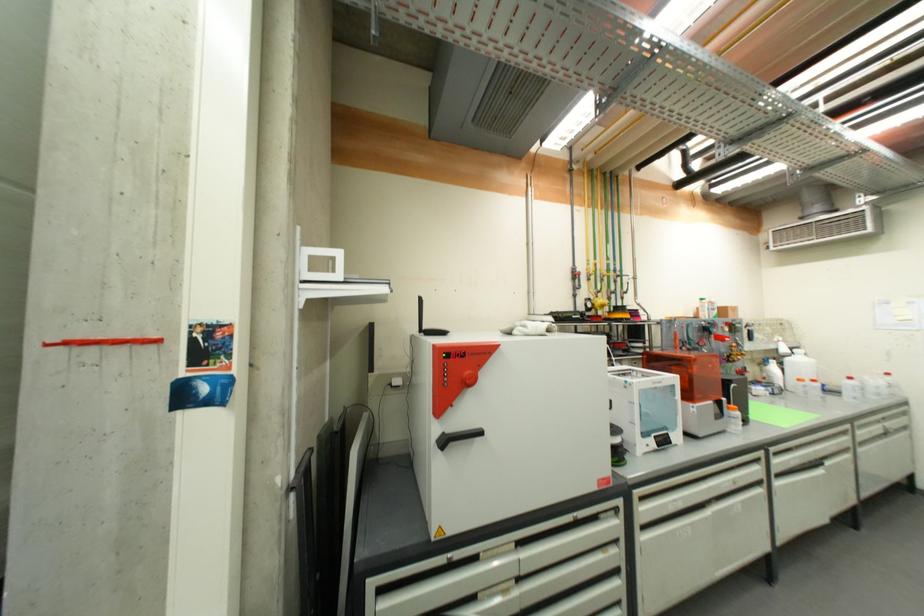
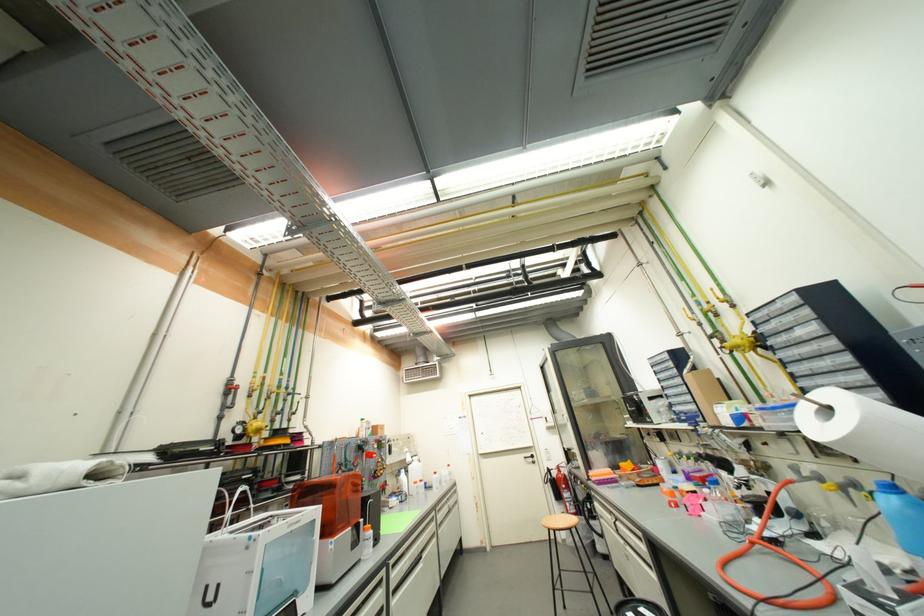
Locate, in the second image, the point that corresponds to (x=779, y=472) in the first image.

(396, 590)